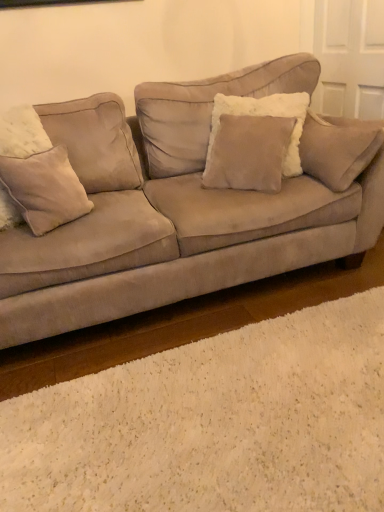
Question: Is suede couch at center taller or shorter than fuzzy beige pillow at left, the first pillow in the left-to-right sequence?

Choices:
 (A) short
 (B) tall

Answer: (B)

Question: Considering their positions, is suede couch at center located in front of or behind fuzzy beige pillow at left, placed as the 2th pillow when sorted from right to left?

Choices:
 (A) behind
 (B) front

Answer: (B)

Question: Estimate the real-world distances between objects in this image. Which object is closer to the suede/velvet pillow at center, positioned as the second pillow in left-to-right order?

Choices:
 (A) fuzzy beige pillow at left, the first pillow in the left-to-right sequence
 (B) suede couch at center

Answer: (B)

Question: Estimate the real-world distances between objects in this image. Which object is closer to the fuzzy beige pillow at left, placed as the 2th pillow when sorted from right to left?

Choices:
 (A) suede/velvet pillow at center, positioned as the second pillow in left-to-right order
 (B) suede couch at center

Answer: (B)